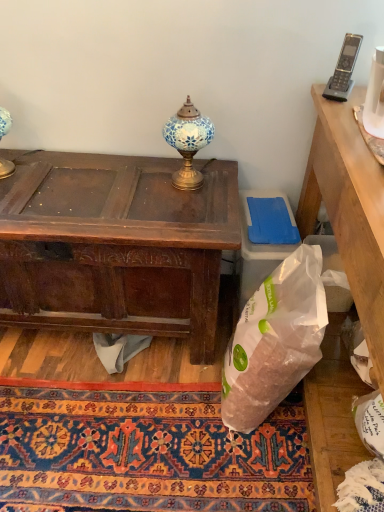
Where is `free space above white plastic trash bin/can at lower right (from a real-world perspective)`? The width and height of the screenshot is (384, 512). free space above white plastic trash bin/can at lower right (from a real-world perspective) is located at coordinates (268, 213).